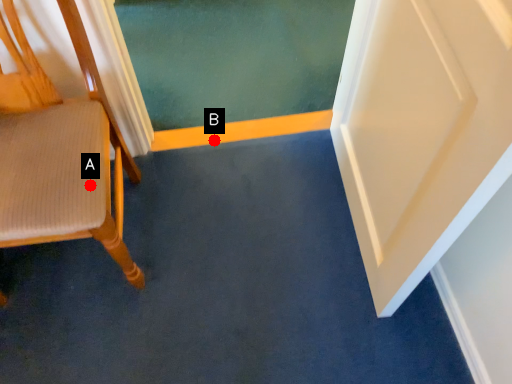
Question: Two points are circled on the image, labeled by A and B beside each circle. Among these points, which one is farthest from the camera?

Choices:
 (A) A is further
 (B) B is further

Answer: (B)